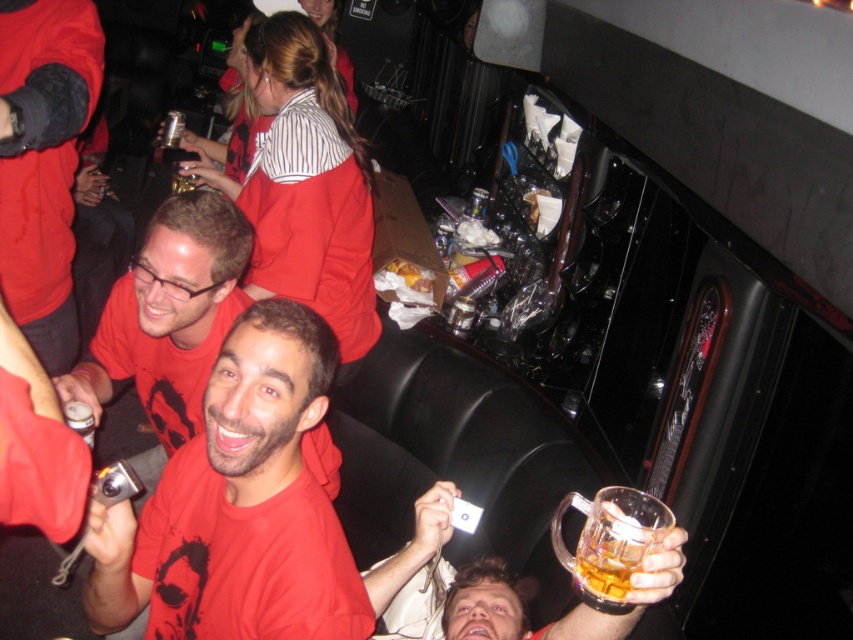
Does matte red shirt at center come in front of translucent glass mug at lower right?

No, it is not.

This screenshot has width=853, height=640. What are the coordinates of `matte red shirt at center` in the screenshot? It's located at (169, 316).

Is translucent glass mug at lower right above metallic silver can at lower left?

Actually, translucent glass mug at lower right is below metallic silver can at lower left.

Is translucent glass mug at lower right to the right of metallic silver can at lower left from the viewer's perspective?

Yes, translucent glass mug at lower right is to the right of metallic silver can at lower left.

Locate an element on the screen. The height and width of the screenshot is (640, 853). translucent glass mug at lower right is located at coordinates (608, 541).

You are a GUI agent. You are given a task and a screenshot of the screen. Output one action in this format:
    pyautogui.click(x=<x>, y=<y>)
    Task: Click on the matte black shirt at upper left
    This screenshot has width=853, height=640.
    Given the screenshot: What is the action you would take?
    click(44, 163)

Does matte black shirt at upper left lie in front of translucent glass mug at lower right?

That is False.

At what (x,y) coordinates should I click in order to perform the action: click on matte black shirt at upper left. Please return your answer as a coordinate pair (x, y). The height and width of the screenshot is (640, 853). Looking at the image, I should click on (44, 163).